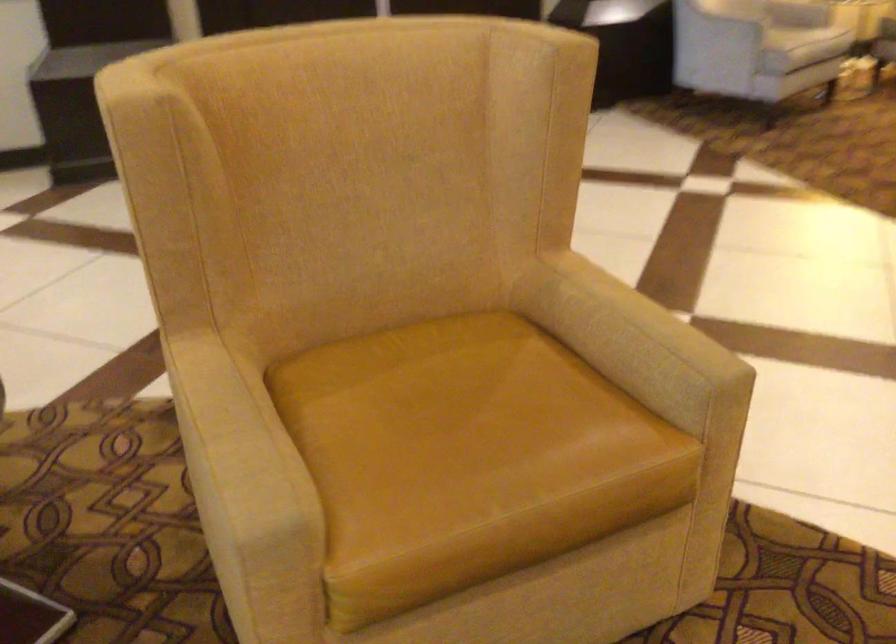
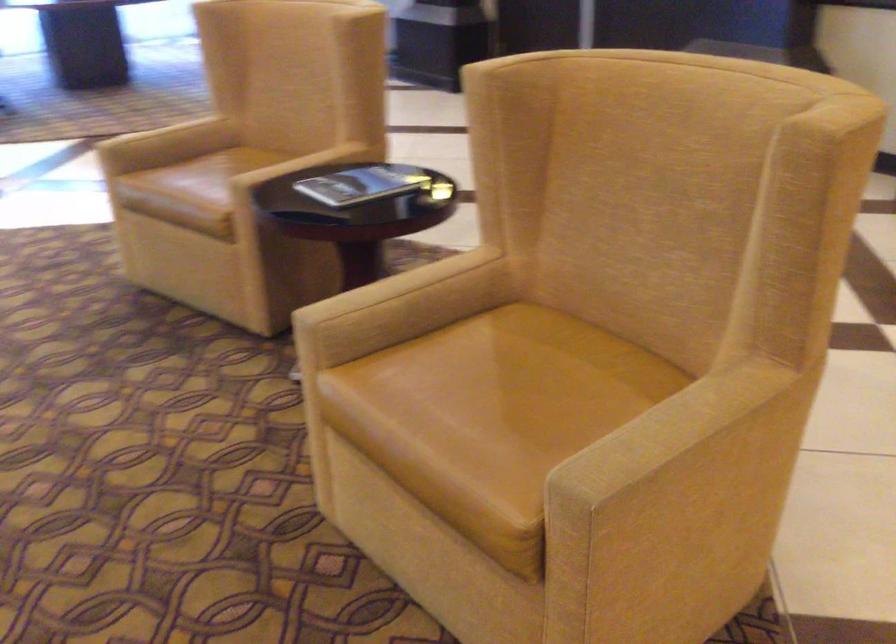
In the second image, find the point that corresponds to point (476, 428) in the first image.

(500, 398)